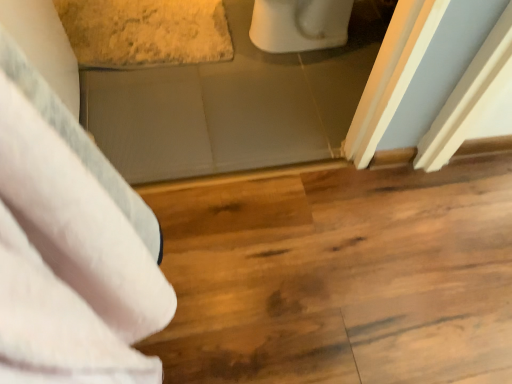
This screenshot has height=384, width=512. What are the coordinates of `white soft towel at left` in the screenshot? It's located at (70, 247).

Describe the element at coordinates (70, 247) in the screenshot. I see `white soft towel at left` at that location.

Identify the location of white soft towel at left. This screenshot has width=512, height=384. (70, 247).